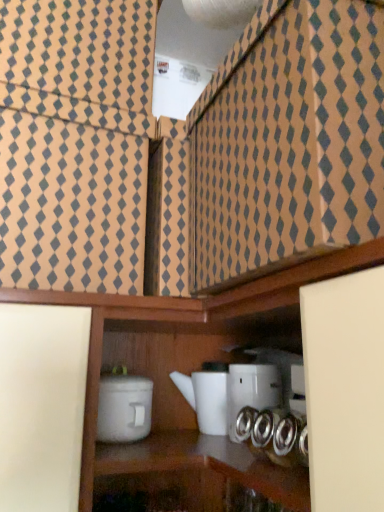
Question: From their relative heights in the image, would you say white matte container at lower center, arranged as the 1th appliance when viewed from the left, is taller or shorter than white glossy teapot at center, which is the 2th appliance from right to left?

Choices:
 (A) short
 (B) tall

Answer: (A)

Question: From a real-world perspective, is white matte container at lower center, arranged as the 1th appliance when viewed from the left, above or below white glossy teapot at center, the second appliance when ordered from left to right?

Choices:
 (A) below
 (B) above

Answer: (A)

Question: Estimate the real-world distances between objects in this image. Which object is farther from the white matte container at lower center, arranged as the 1th appliance when viewed from the left?

Choices:
 (A) white glossy teapot at center, which is the 2th appliance from right to left
 (B) white glossy teapot at center, the 3th appliance from the left

Answer: (B)

Question: Estimate the real-world distances between objects in this image. Which object is farther from the white glossy teapot at center, which ranks as the 1th appliance in right-to-left order?

Choices:
 (A) white matte container at lower center, which is counted as the third appliance, starting from the right
 (B) white glossy teapot at center, the second appliance when ordered from left to right

Answer: (A)